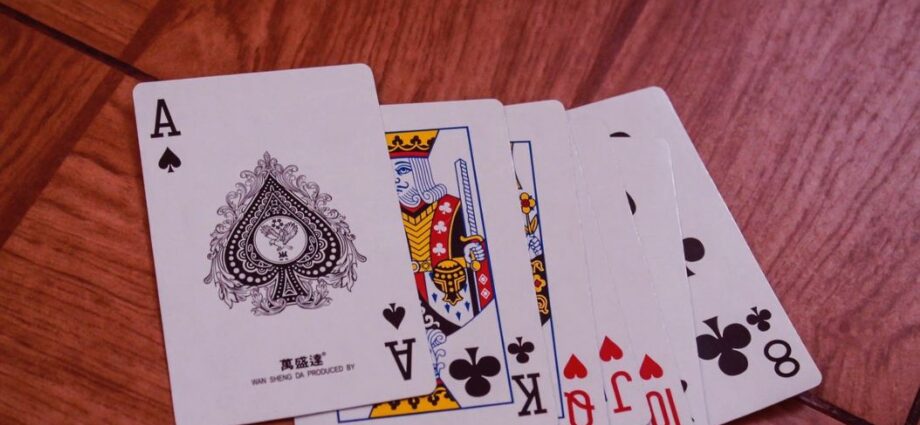
You are a GUI agent. You are given a task and a screenshot of the screen. Output one action in this format:
    pyautogui.click(x=<x>, y=<y>)
    Task: Click on the playing cards
    
    Given the screenshot: What is the action you would take?
    pyautogui.click(x=290, y=242), pyautogui.click(x=440, y=237), pyautogui.click(x=552, y=251), pyautogui.click(x=608, y=272), pyautogui.click(x=636, y=295), pyautogui.click(x=668, y=281), pyautogui.click(x=708, y=255)